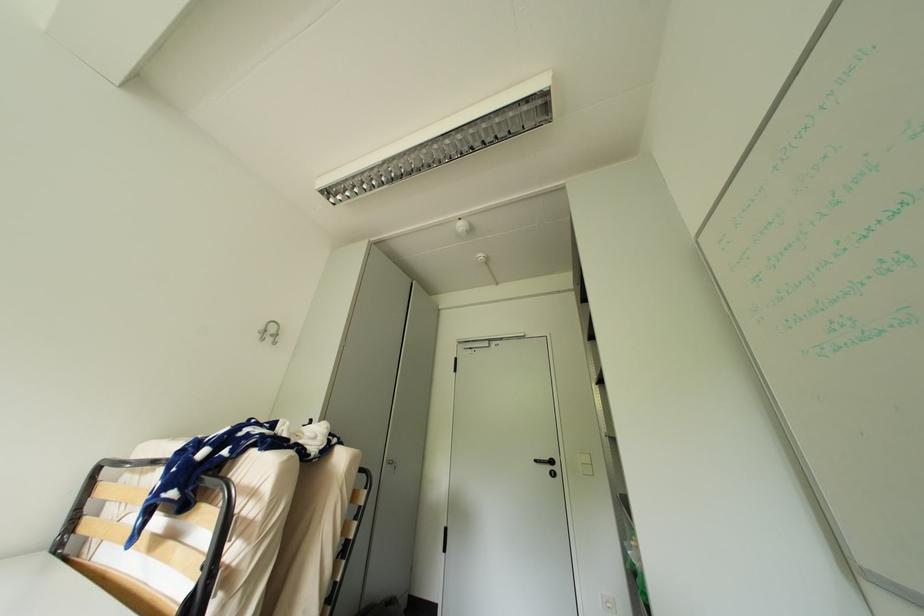
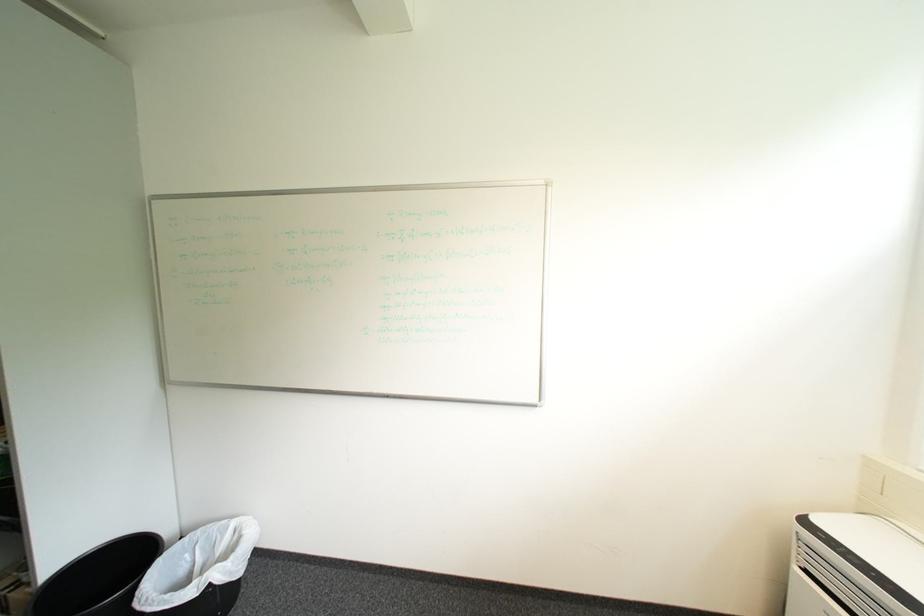
Question: Based on the continuous images, in which direction is the camera rotating? Reply with the corresponding letter.

Choices:
 (A) Left
 (B) Right
 (C) Up
 (D) Down

Answer: (B)